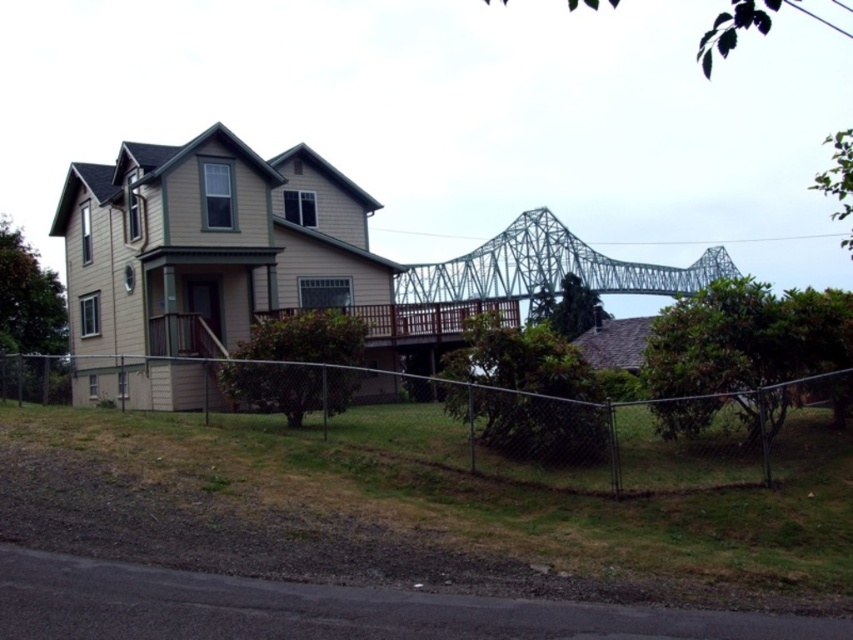
You are standing at the front door of the two story residential house. You see a point marked at coordinates [518,422]. What object is located at that point?

The point at coordinates [518,422] marks the chain link fence at lower center.